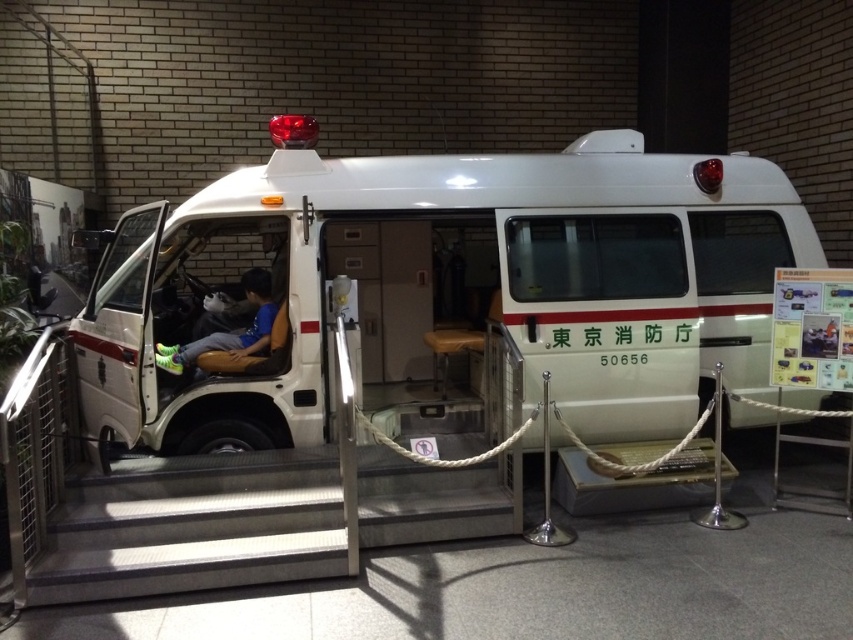
You are a photographer setting up a shoot inside the white glossy van at center. You have a matte black sneakers at center placed on the floor. If you want to place a large camera on the floor without overlapping the sneakers, where should you position it?

The white glossy van at center might be wider than matte black sneakers at center, so you can place the camera on the floor away from the sneakers to avoid overlapping.

You are a photographer trying to capture a clear shot of the metallic silver stairs at center and the matte black sneakers at center inside the ambulance. Which object will appear larger in your photo?

The metallic silver stairs at center will appear larger in the photo because they are closer to the viewer than the matte black sneakers at center.